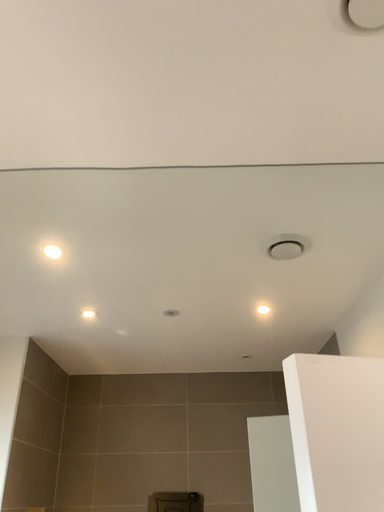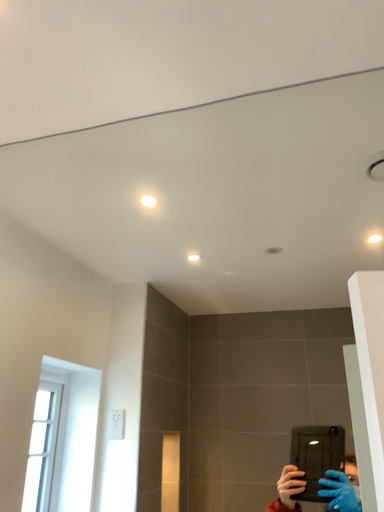
Question: Which way did the camera rotate in the video?

Choices:
 (A) rotated right
 (B) rotated left

Answer: (B)